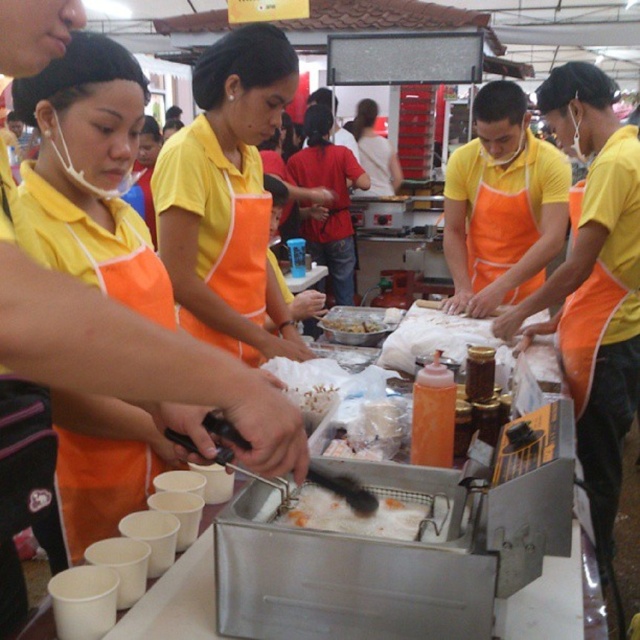
Consider the image. Which is below, fried batter at center or matte yellow shirt at center?

Positioned lower is fried batter at center.

Is point (316, 506) closer to viewer compared to point (394, 154)?

Yes.

Is point (346, 529) closer to camera compared to point (372, 115)?

Yes, point (346, 529) is closer to viewer.

The image size is (640, 640). I want to click on fried batter at center, so click(x=353, y=515).

Does matte yellow shirt at center appear on the right side of yellow matte fried chicken at center?

Indeed, matte yellow shirt at center is positioned on the right side of yellow matte fried chicken at center.

Which is behind, point (380, 173) or point (333, 323)?

The point (380, 173) is behind.

This screenshot has height=640, width=640. Describe the element at coordinates (374, 150) in the screenshot. I see `matte yellow shirt at center` at that location.

The height and width of the screenshot is (640, 640). In order to click on matte yellow shirt at center in this screenshot , I will do `click(374, 150)`.

Who is shorter, orange apron at center or fried batter at center?

fried batter at center is shorter.

Who is more distant from viewer, (184, 342) or (396, 499)?

Point (396, 499)

You are a GUI agent. You are given a task and a screenshot of the screen. Output one action in this format:
    pyautogui.click(x=<x>, y=<y>)
    Task: Click on the orange apron at center
    The width and height of the screenshot is (640, 640).
    Given the screenshot: What is the action you would take?
    pyautogui.click(x=118, y=376)